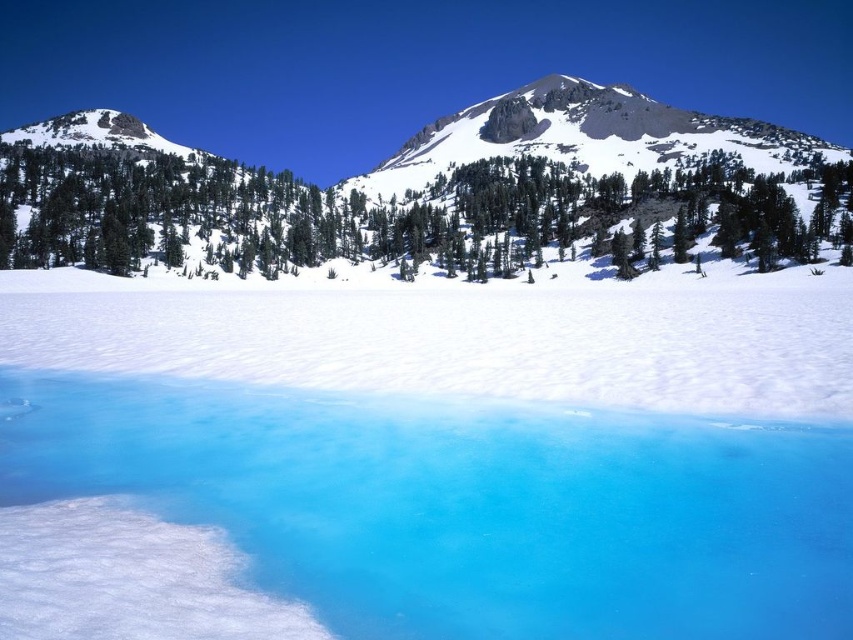
You are an explorer standing at the edge of the frozen lake. You see the translucent ice water at center and the green matte tree at center. Which object is closer to you?

The translucent ice water at center is closer to you because it is in front of the green matte tree at center.

You are an environmental scientist assessing the alpine landscape. You need to determine which object, the translucent ice water at center or the green matte tree at center, is closer to the observer. Based on the scene, which one is lower in height?

The translucent ice water at center has a lesser height compared to the green matte tree at center, so the translucent ice water at center is closer to the observer.